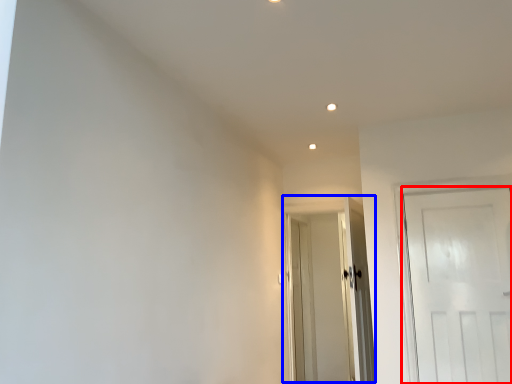
Question: Which point is further to the camera, door (highlighted by a red box) or door (highlighted by a blue box)?

Choices:
 (A) door
 (B) door

Answer: (B)